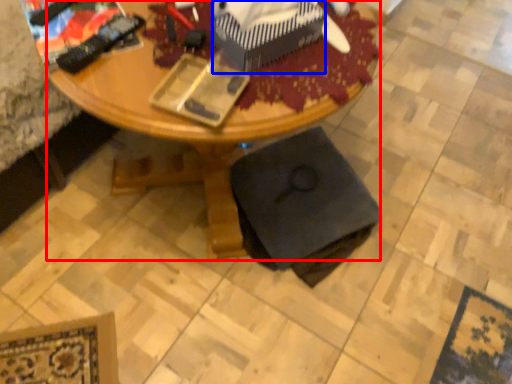
Question: Which point is further to the camera, desk (highlighted by a red box) or box (highlighted by a blue box)?

Choices:
 (A) desk
 (B) box

Answer: (B)